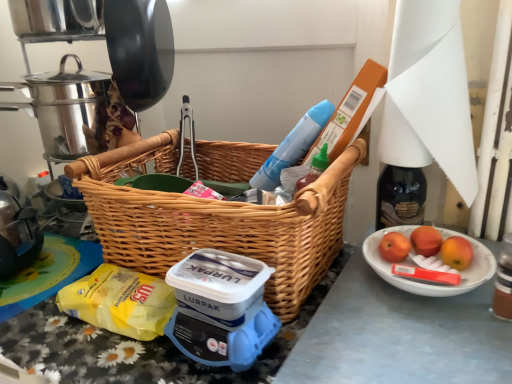
Question: From a real-world perspective, is woven wood picnic basket at center located higher than white ceramic bowl at lower right?

Choices:
 (A) no
 (B) yes

Answer: (B)

Question: Is woven wood picnic basket at center not near white ceramic bowl at lower right?

Choices:
 (A) no
 (B) yes

Answer: (A)

Question: Is woven wood picnic basket at center shorter than white ceramic bowl at lower right?

Choices:
 (A) no
 (B) yes

Answer: (A)

Question: Considering the relative positions of woven wood picnic basket at center and white ceramic bowl at lower right in the image provided, is woven wood picnic basket at center to the left of white ceramic bowl at lower right from the viewer's perspective?

Choices:
 (A) no
 (B) yes

Answer: (B)

Question: From the image's perspective, does woven wood picnic basket at center appear lower than white ceramic bowl at lower right?

Choices:
 (A) yes
 (B) no

Answer: (B)

Question: Is shiny metallic crock pot at upper left bigger or smaller than yellow plastic bag at lower left?

Choices:
 (A) small
 (B) big

Answer: (B)

Question: Is shiny metallic crock pot at upper left in front of or behind yellow plastic bag at lower left in the image?

Choices:
 (A) front
 (B) behind

Answer: (B)

Question: Is shiny metallic crock pot at upper left wider or thinner than yellow plastic bag at lower left?

Choices:
 (A) wide
 (B) thin

Answer: (A)

Question: From a real-world perspective, is shiny metallic crock pot at upper left positioned above or below yellow plastic bag at lower left?

Choices:
 (A) below
 (B) above

Answer: (B)

Question: Is shiny metallic crock pot at upper left inside the boundaries of white ceramic bowl at lower right, or outside?

Choices:
 (A) inside
 (B) outside

Answer: (B)

Question: From their relative heights in the image, would you say shiny metallic crock pot at upper left is taller or shorter than white ceramic bowl at lower right?

Choices:
 (A) short
 (B) tall

Answer: (B)

Question: Relative to white ceramic bowl at lower right, is shiny metallic crock pot at upper left in front or behind?

Choices:
 (A) front
 (B) behind

Answer: (B)

Question: From a real-world perspective, relative to white ceramic bowl at lower right, is shiny metallic crock pot at upper left vertically above or below?

Choices:
 (A) above
 (B) below

Answer: (A)

Question: Which is correct: yellow plastic bag at lower left is inside white ceramic bowl at lower right, or outside of it?

Choices:
 (A) inside
 (B) outside

Answer: (B)

Question: Considering the positions of yellow plastic bag at lower left and white ceramic bowl at lower right in the image, is yellow plastic bag at lower left taller or shorter than white ceramic bowl at lower right?

Choices:
 (A) short
 (B) tall

Answer: (B)